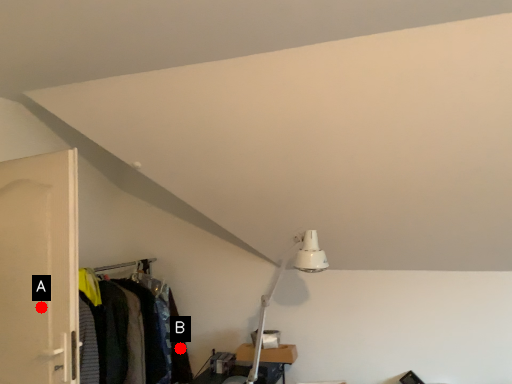
Question: Two points are circled on the image, labeled by A and B beside each circle. Which of the following is the farthest from the observer?

Choices:
 (A) A is further
 (B) B is further

Answer: (B)